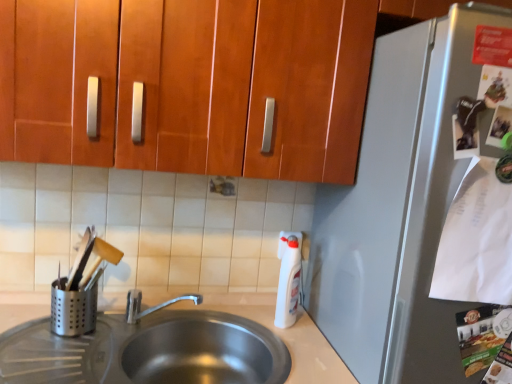
Question: Does white plastic bottle at right touch wooden cabinet at upper center?

Choices:
 (A) no
 (B) yes

Answer: (A)

Question: Is white plastic bottle at right to the left of wooden cabinet at upper center from the viewer's perspective?

Choices:
 (A) yes
 (B) no

Answer: (B)

Question: Considering the relative positions of white plastic bottle at right and wooden cabinet at upper center in the image provided, is white plastic bottle at right in front of wooden cabinet at upper center?

Choices:
 (A) no
 (B) yes

Answer: (A)

Question: From the image's perspective, is white plastic bottle at right located beneath wooden cabinet at upper center?

Choices:
 (A) yes
 (B) no

Answer: (A)

Question: Is white plastic bottle at right thinner than wooden cabinet at upper center?

Choices:
 (A) yes
 (B) no

Answer: (A)

Question: Do you think wooden cabinet at upper center is within silver metallic utensil holder at left, or outside of it?

Choices:
 (A) inside
 (B) outside

Answer: (B)

Question: Is wooden cabinet at upper center taller or shorter than silver metallic utensil holder at left?

Choices:
 (A) short
 (B) tall

Answer: (B)

Question: From a real-world perspective, is wooden cabinet at upper center positioned above or below silver metallic utensil holder at left?

Choices:
 (A) above
 (B) below

Answer: (A)

Question: Is point (168, 72) closer or farther from the camera than point (53, 319)?

Choices:
 (A) closer
 (B) farther

Answer: (A)

Question: In the image, is silver metallic utensil holder at left positioned in front of or behind satin silver sink at lower left?

Choices:
 (A) front
 (B) behind

Answer: (B)

Question: From their relative heights in the image, would you say silver metallic utensil holder at left is taller or shorter than satin silver sink at lower left?

Choices:
 (A) short
 (B) tall

Answer: (A)

Question: Is silver metallic utensil holder at left wider or thinner than satin silver sink at lower left?

Choices:
 (A) thin
 (B) wide

Answer: (A)

Question: From the image's perspective, relative to satin silver sink at lower left, is silver metallic utensil holder at left above or below?

Choices:
 (A) above
 (B) below

Answer: (A)

Question: Is point (287, 274) positioned closer to the camera than point (77, 299)?

Choices:
 (A) closer
 (B) farther

Answer: (B)

Question: In terms of width, does white plastic bottle at right look wider or thinner when compared to silver metallic utensil holder at left?

Choices:
 (A) thin
 (B) wide

Answer: (B)